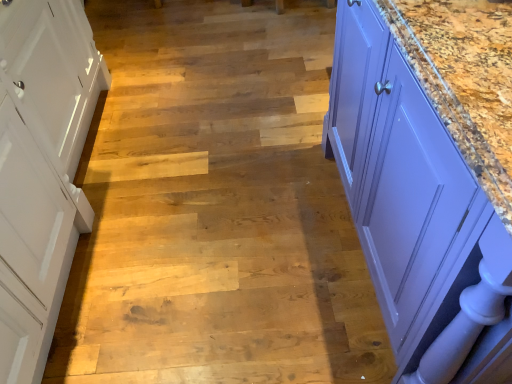
Question: Considering the positions of white wood cabinet at left and wooden stair at center in the image, is white wood cabinet at left taller or shorter than wooden stair at center?

Choices:
 (A) tall
 (B) short

Answer: (A)

Question: Is white wood cabinet at left wider or thinner than wooden stair at center?

Choices:
 (A) thin
 (B) wide

Answer: (A)

Question: Estimate the real-world distances between objects in this image. Which object is farther from the white wood cabinet at left?

Choices:
 (A) wooden stair at center
 (B) purple glossy cabinet at right

Answer: (B)

Question: Based on their relative distances, which object is nearer to the white wood cabinet at left?

Choices:
 (A) purple glossy cabinet at right
 (B) wooden stair at center

Answer: (B)